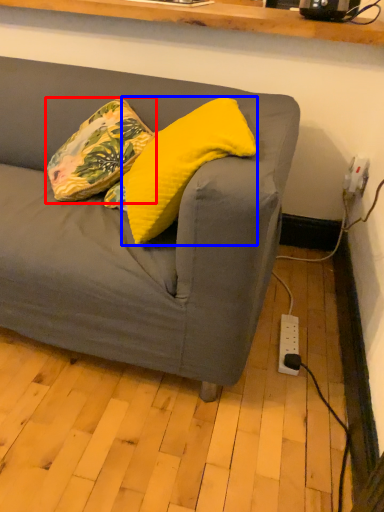
Question: Which point is closer to the camera, pillow (highlighted by a red box) or pillow (highlighted by a blue box)?

Choices:
 (A) pillow
 (B) pillow

Answer: (B)